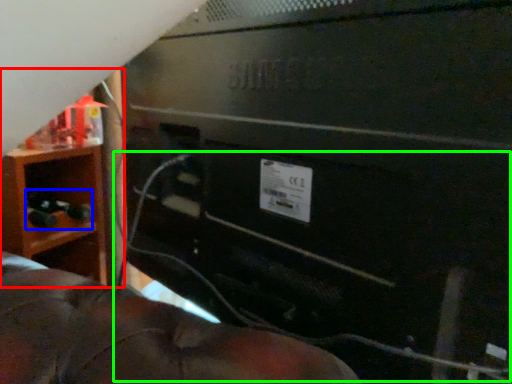
Question: Which is nearer to the furniture (highlighted by a red box)? toy (highlighted by a blue box) or wire (highlighted by a green box).

Choices:
 (A) toy
 (B) wire

Answer: (A)